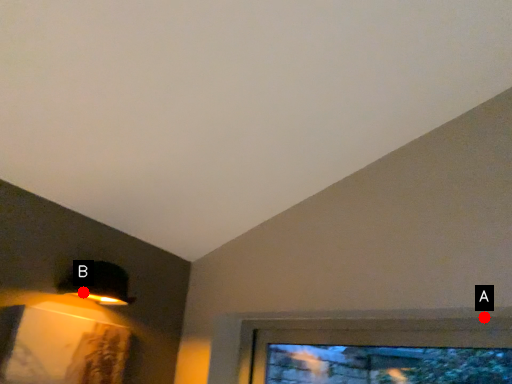
Question: Two points are circled on the image, labeled by A and B beside each circle. Which of the following is the closest to the observer?

Choices:
 (A) A is closer
 (B) B is closer

Answer: (A)